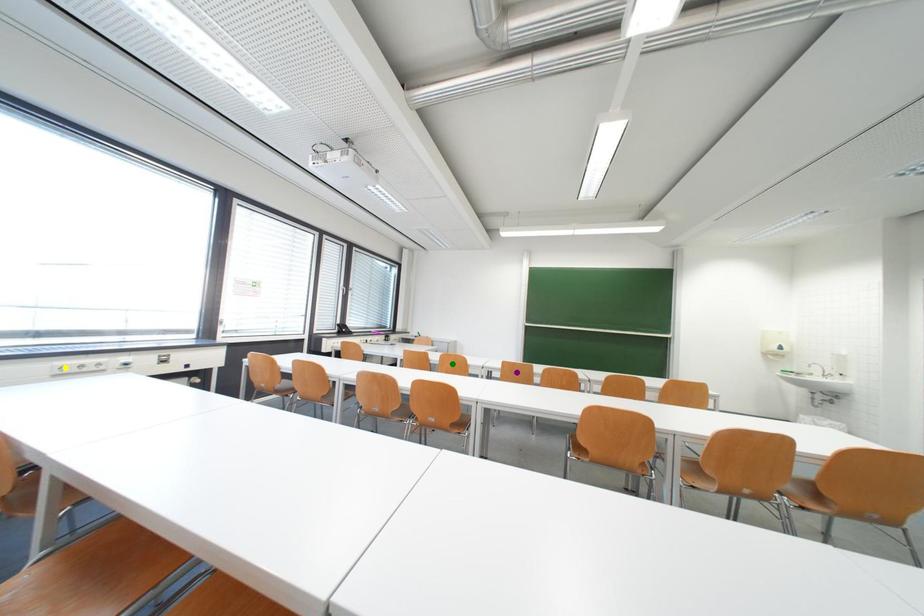
Order these from nearest to farthest:
purple point | yellow point | green point

yellow point < purple point < green point